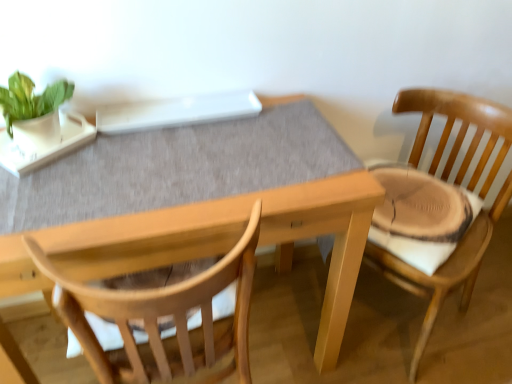
Question: Is wooden table at center positioned before wooden chair at right?

Choices:
 (A) no
 (B) yes

Answer: (B)

Question: Considering the relative sizes of wooden table at center and wooden chair at right in the image provided, is wooden table at center thinner than wooden chair at right?

Choices:
 (A) yes
 (B) no

Answer: (B)

Question: Considering the relative positions of wooden table at center and wooden chair at right in the image provided, is wooden table at center behind wooden chair at right?

Choices:
 (A) yes
 (B) no

Answer: (B)

Question: Could you tell me if wooden table at center is turned towards wooden chair at right?

Choices:
 (A) no
 (B) yes

Answer: (A)

Question: Is wooden chair at right at the back of wooden table at center?

Choices:
 (A) no
 (B) yes

Answer: (A)

Question: From their relative heights in the image, would you say green matte plant at upper left is taller or shorter than wooden chair at right?

Choices:
 (A) short
 (B) tall

Answer: (A)

Question: Looking at their shapes, would you say green matte plant at upper left is wider or thinner than wooden chair at right?

Choices:
 (A) thin
 (B) wide

Answer: (A)

Question: Does point (4, 91) appear closer or farther from the camera than point (395, 276)?

Choices:
 (A) closer
 (B) farther

Answer: (A)

Question: From a real-world perspective, is green matte plant at upper left physically located above or below wooden chair at right?

Choices:
 (A) below
 (B) above

Answer: (B)

Question: In the image, is wooden table at center on the left side or the right side of green matte plant at upper left?

Choices:
 (A) left
 (B) right

Answer: (B)

Question: Which is correct: wooden table at center is inside green matte plant at upper left, or outside of it?

Choices:
 (A) outside
 (B) inside

Answer: (A)

Question: Is wooden table at center in front of or behind green matte plant at upper left in the image?

Choices:
 (A) front
 (B) behind

Answer: (A)

Question: From the image's perspective, is wooden table at center above or below green matte plant at upper left?

Choices:
 (A) above
 (B) below

Answer: (B)

Question: Do you think wooden chair at right is within wooden table at center, or outside of it?

Choices:
 (A) inside
 (B) outside

Answer: (B)

Question: Is wooden chair at right in front of or behind wooden table at center in the image?

Choices:
 (A) front
 (B) behind

Answer: (B)